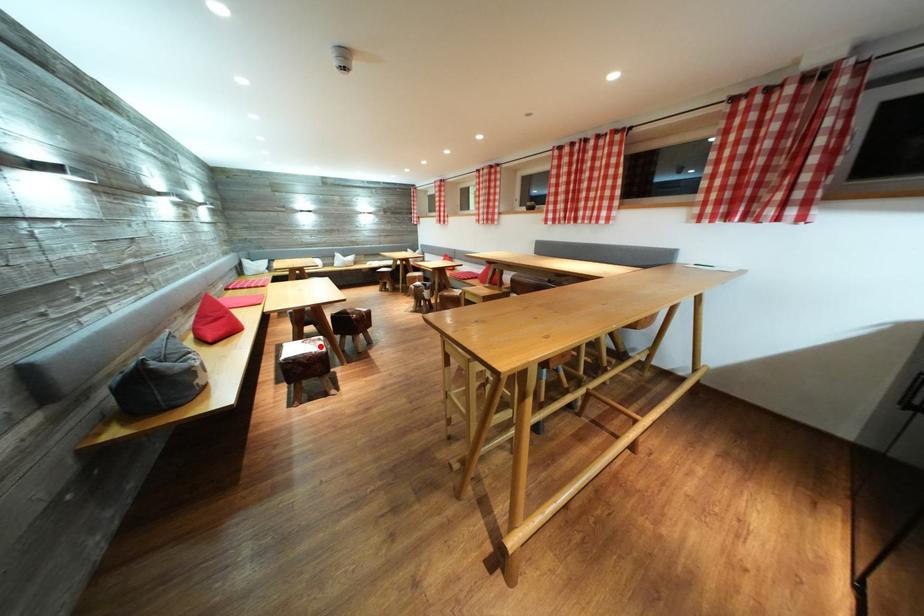
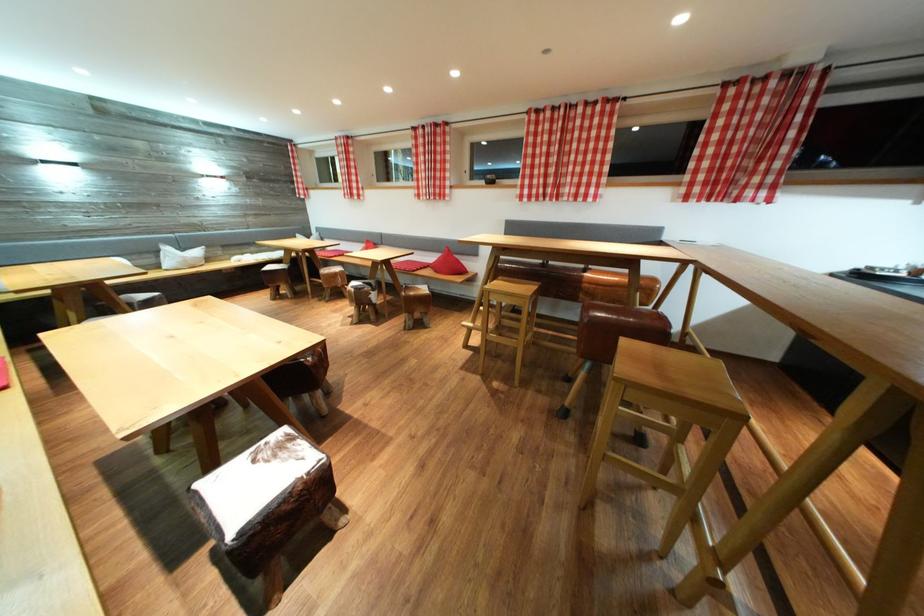
Question: I am providing you with two images of the same scene from different viewpoints. Given a red point in image1, look at the same physical point in image2. Is it:

Choices:
 (A) Closer to the viewpoint
 (B) Farther from the viewpoint

Answer: (B)